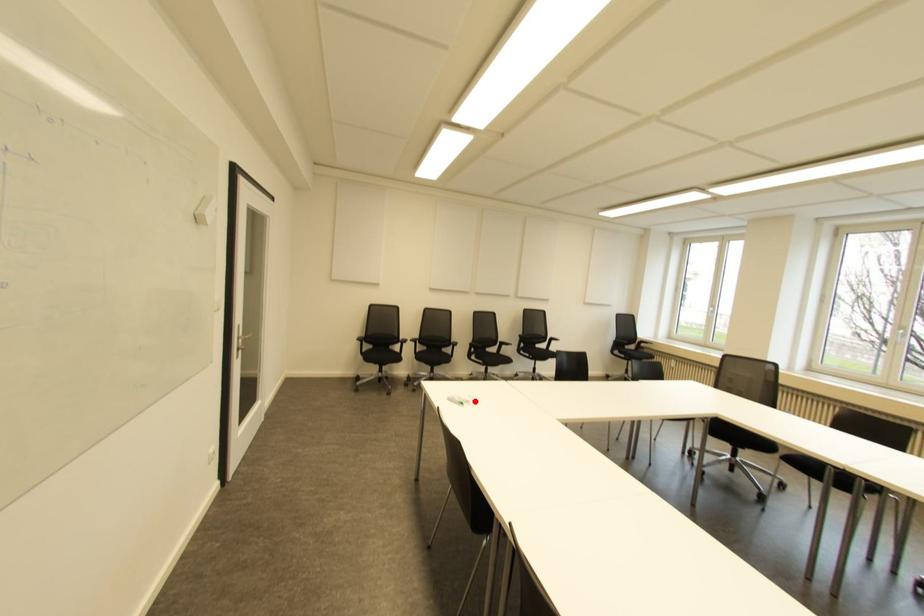
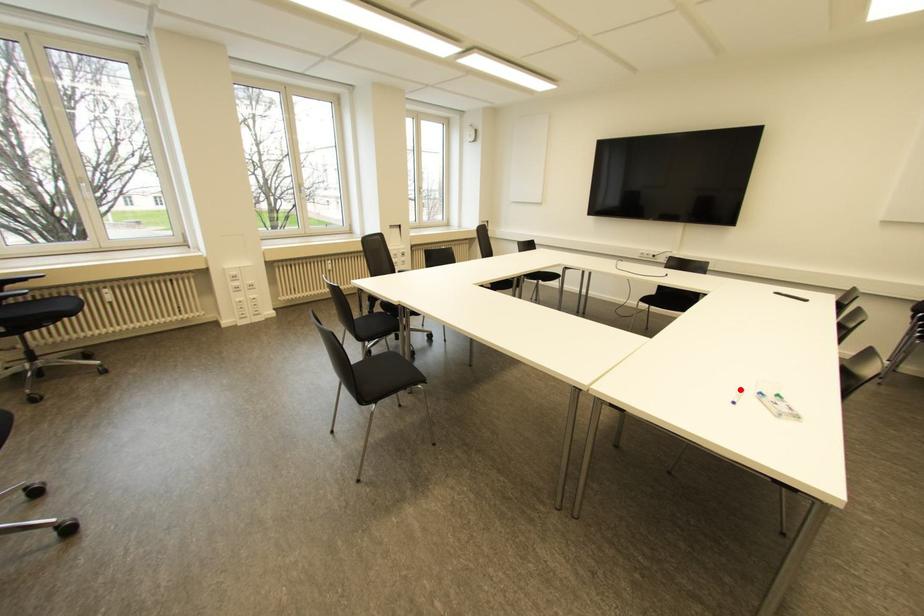
I am providing you with two images of the same scene from different viewpoints. A red point is marked on the first image and another point is marked on the second image. Does the point marked in image1 correspond to the same location as the one in image2?

Yes